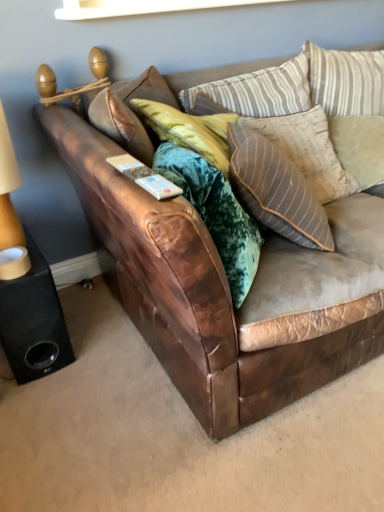
The width and height of the screenshot is (384, 512). I want to click on free space in front of black matte speaker at lower left, so click(x=38, y=403).